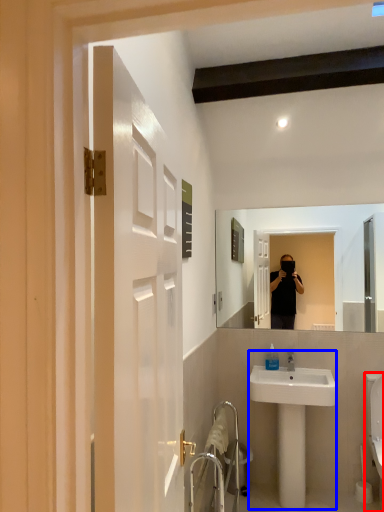
Question: Among these objects, which one is nearest to the camera, toilet (highlighted by a red box) or sink (highlighted by a blue box)?

Choices:
 (A) toilet
 (B) sink

Answer: (A)